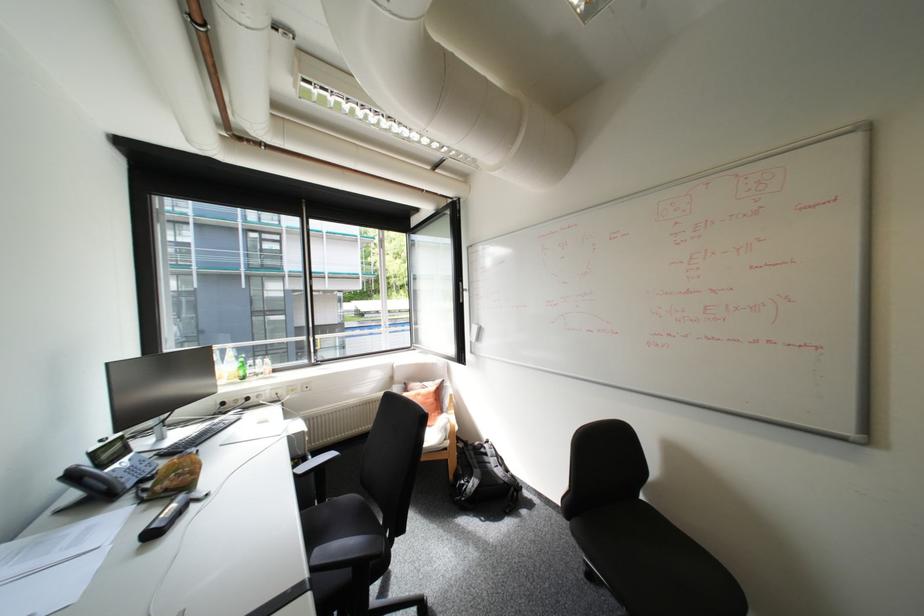
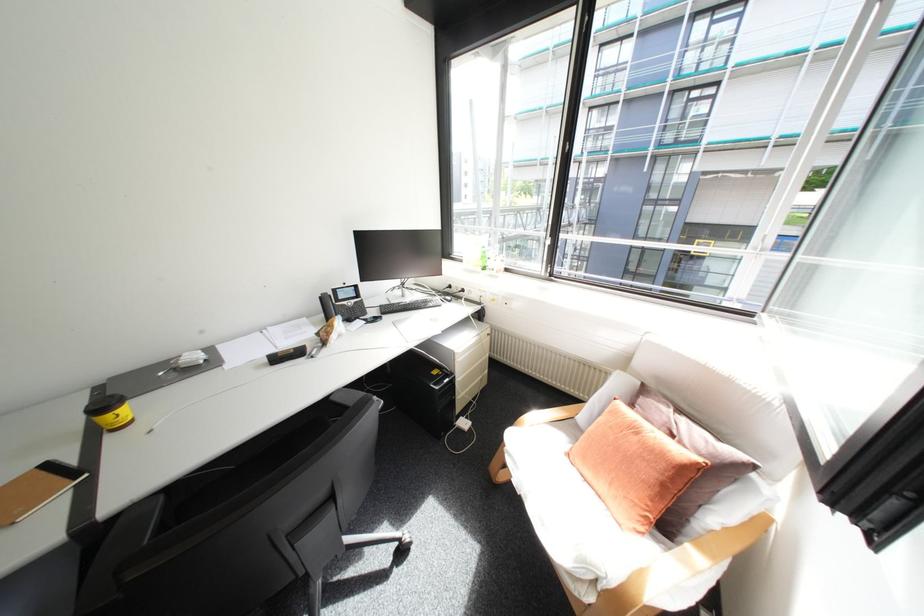
Find the pixel in the second image that matches (x=179, y=446) in the first image.

(403, 304)